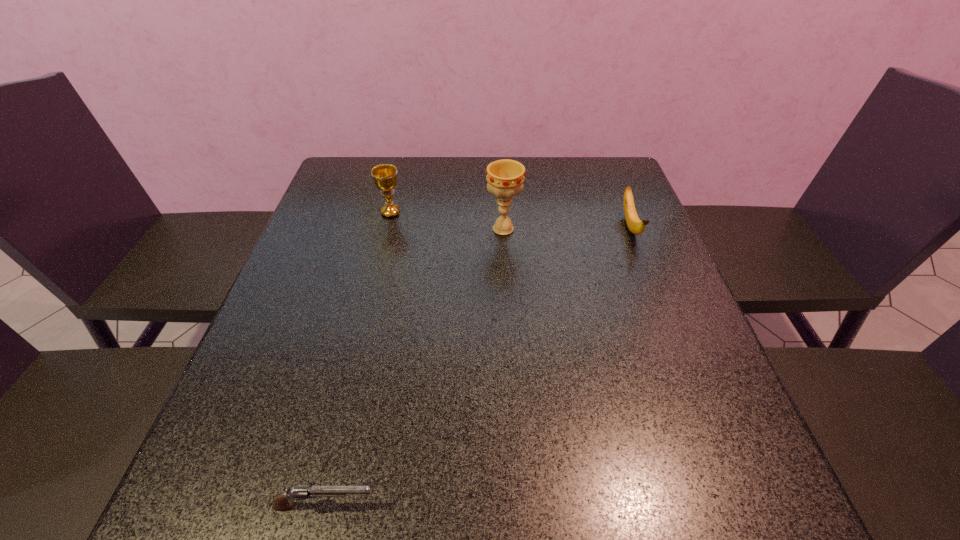
Image resolution: width=960 pixels, height=540 pixels. Find the location of `the third object from left to right`. the third object from left to right is located at coordinates (505, 177).

At what (x,y) coordinates should I click in order to perform the action: click on the tallest object. Please return your answer as a coordinate pair (x, y). This screenshot has height=540, width=960. Looking at the image, I should click on (505, 177).

Locate an element on the screen. This screenshot has height=540, width=960. the shorter chalice is located at coordinates (385, 179).

Image resolution: width=960 pixels, height=540 pixels. I want to click on the third shortest object, so click(x=385, y=179).

The image size is (960, 540). I want to click on the rightmost object, so click(635, 225).

Find the location of a particular element. This screenshot has width=960, height=540. banana is located at coordinates (635, 225).

Find the location of a particular element. The height and width of the screenshot is (540, 960). gun is located at coordinates (282, 501).

This screenshot has height=540, width=960. I want to click on the nearest object, so click(282, 501).

You are a GUI agent. You are given a task and a screenshot of the screen. Output one action in this format:
    pyautogui.click(x=<x>, y=<y>)
    Task: Click on the vacant space located 0.320m on the front of the second object from right to left
    The height and width of the screenshot is (540, 960).
    Given the screenshot: What is the action you would take?
    pyautogui.click(x=510, y=343)

Where is `vacant space located 0.140m on the back of the shorter chalice`? The height and width of the screenshot is (540, 960). vacant space located 0.140m on the back of the shorter chalice is located at coordinates (399, 178).